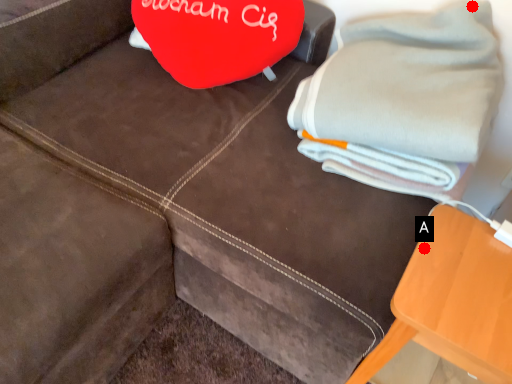
Question: Two points are circled on the image, labeled by A and B beside each circle. Which of the following is the farthest from the observer?

Choices:
 (A) A is further
 (B) B is further

Answer: (B)